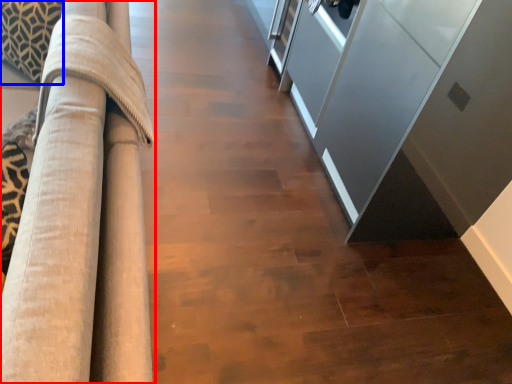
Question: Which object is further to the camera taking this photo, furniture (highlighted by a red box) or pillow (highlighted by a blue box)?

Choices:
 (A) furniture
 (B) pillow

Answer: (B)